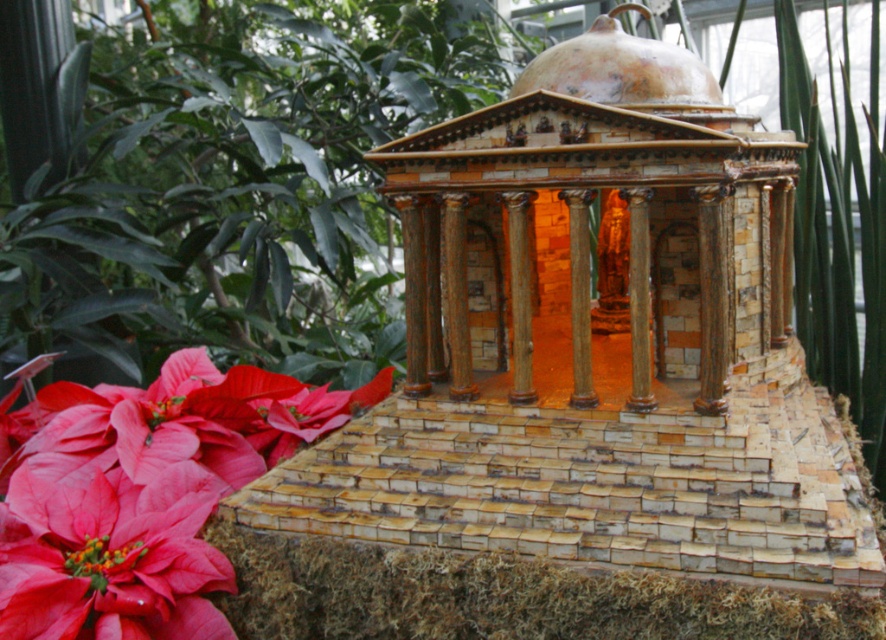
Between matte pink petals at lower left and matte red flower at lower left, which one is positioned lower?

matte red flower at lower left is below.

What do you see at coordinates (141, 493) in the screenshot?
I see `matte pink petals at lower left` at bounding box center [141, 493].

You are a GUI agent. You are given a task and a screenshot of the screen. Output one action in this format:
    pyautogui.click(x=<x>, y=<y>)
    Task: Click on the matte pink petals at lower left
    
    Given the screenshot: What is the action you would take?
    [141, 493]